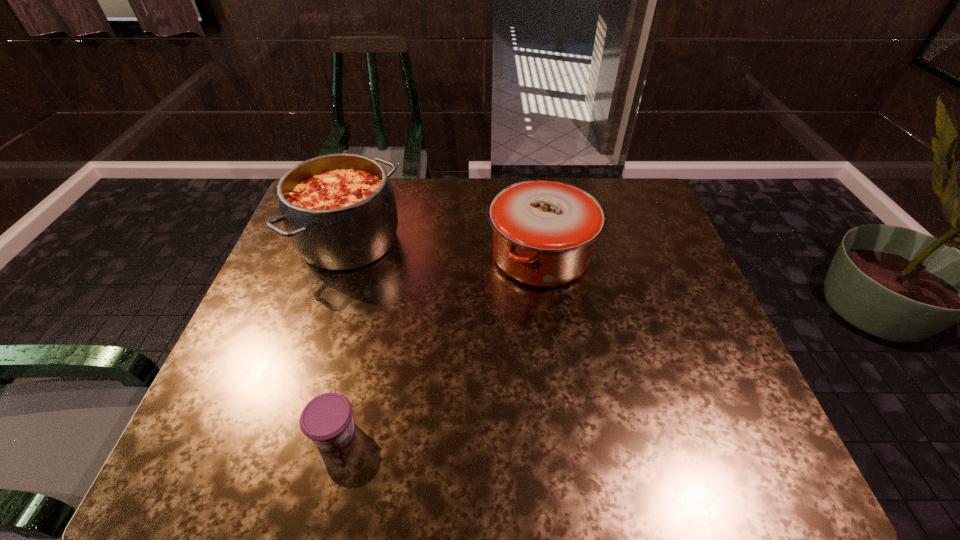
Locate an element on the screen. vacant area at the near edge is located at coordinates (653, 474).

What are the coordinates of `vacant space at the left edge of the desktop` in the screenshot? It's located at (225, 395).

The height and width of the screenshot is (540, 960). I want to click on free space between the left casserole and the right casserole, so click(444, 248).

At what (x,y) coordinates should I click in order to perform the action: click on vacant space in between the rightmost object and the jam. Please return your answer as a coordinate pair (x, y). The width and height of the screenshot is (960, 540). Looking at the image, I should click on (438, 345).

This screenshot has height=540, width=960. I want to click on vacant area between the rightmost object and the jam, so click(438, 345).

Find the location of a particular element. blank region between the left casserole and the rightmost object is located at coordinates (444, 248).

I want to click on empty space between the left casserole and the rightmost object, so click(x=444, y=248).

The height and width of the screenshot is (540, 960). I want to click on vacant space that is in between the rightmost object and the left casserole, so pyautogui.click(x=444, y=248).

In order to click on vacant space in between the shortest object and the left casserole in this screenshot , I will do `click(342, 337)`.

The height and width of the screenshot is (540, 960). I want to click on vacant area that lies between the right casserole and the jam, so click(x=438, y=345).